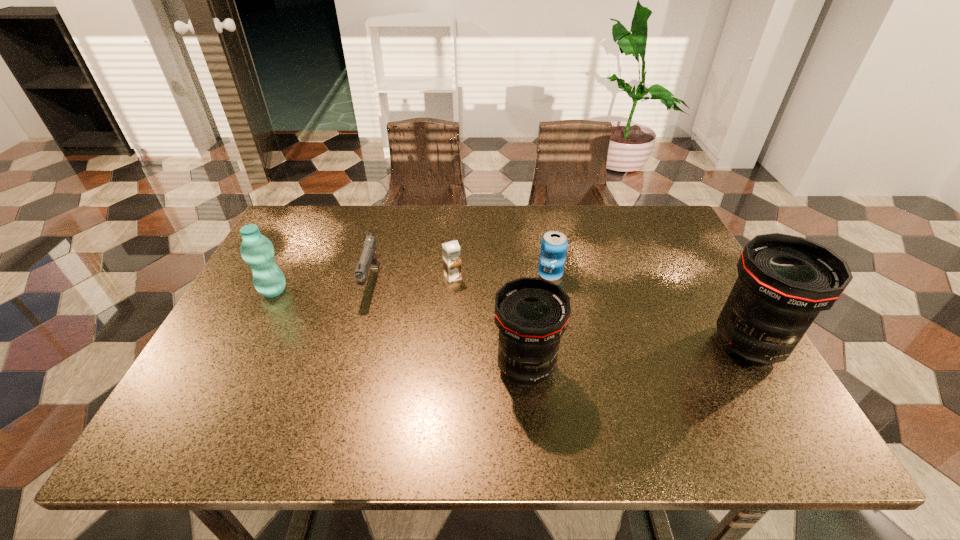
The width and height of the screenshot is (960, 540). Identify the location of free space located 0.130m on the front of the chocolate milk. (450, 319).

Identify the location of vacant space located on the left of the soda can. (392, 274).

This screenshot has height=540, width=960. In order to click on free spot located on the right of the bottle in this screenshot , I will do `click(368, 291)`.

You are a GUI agent. You are given a task and a screenshot of the screen. Output one action in this format:
    pyautogui.click(x=<x>, y=<y>)
    Task: Click on the object that is at the left edge
    Image resolution: width=960 pixels, height=540 pixels.
    Given the screenshot: What is the action you would take?
    pyautogui.click(x=257, y=251)

At what (x,y) coordinates should I click in order to perform the action: click on object present at the right edge. Please return your answer as a coordinate pair (x, y). Looking at the image, I should click on (784, 281).

Locate an element on the screen. object located at the near right corner is located at coordinates (784, 281).

You are a GUI agent. You are given a task and a screenshot of the screen. Output one action in this format:
    pyautogui.click(x=<x>, y=<y>)
    Task: Click on the vacant point at the far edge
    This screenshot has width=960, height=540.
    Given the screenshot: What is the action you would take?
    pyautogui.click(x=613, y=208)

Locate an element on the screen. This screenshot has width=960, height=540. free space at the near edge of the desktop is located at coordinates (670, 397).

The width and height of the screenshot is (960, 540). In the image, there is a desktop. What are the coordinates of `vacant space at the left edge` in the screenshot? It's located at (309, 252).

Locate an element on the screen. The image size is (960, 540). free spot at the right edge of the desktop is located at coordinates (663, 269).